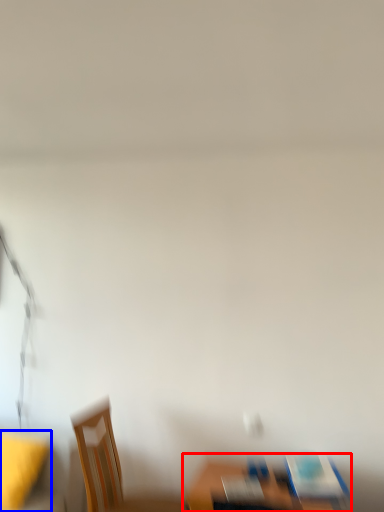
Question: Which of the following is the closest to the observer, furniture (highlighted by a red box) or table (highlighted by a blue box)?

Choices:
 (A) furniture
 (B) table

Answer: (A)